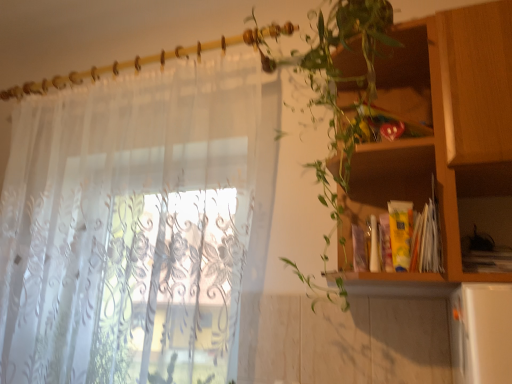
Describe the element at coordinates (137, 225) in the screenshot. I see `translucent white curtain at left` at that location.

Locate an element on the screen. The width and height of the screenshot is (512, 384). green leafy plant at upper right is located at coordinates click(339, 82).

Where is `translucent white curtain at left`? This screenshot has height=384, width=512. translucent white curtain at left is located at coordinates (137, 225).

Between green leafy plant at upper right and wooden cabinet at right, which one is positioned in front?

Positioned in front is green leafy plant at upper right.

Locate an element on the screen. The height and width of the screenshot is (384, 512). shelf that is on the right side of green leafy plant at upper right is located at coordinates (441, 130).

Does green leafy plant at upper right have a smaller size compared to wooden cabinet at right?

Incorrect, green leafy plant at upper right is not smaller in size than wooden cabinet at right.

Would you say green leafy plant at upper right is a long distance from wooden cabinet at right?

No, there isn't a large distance between green leafy plant at upper right and wooden cabinet at right.

In the scene shown: Does wooden cabinet at right have a greater height compared to green leafy plant at upper right?

Incorrect, the height of wooden cabinet at right is not larger of that of green leafy plant at upper right.

From a real-world perspective, who is located lower, wooden cabinet at right or green leafy plant at upper right?

wooden cabinet at right is physically lower.

Is wooden cabinet at right to the left of green leafy plant at upper right from the viewer's perspective?

In fact, wooden cabinet at right is to the right of green leafy plant at upper right.

In the scene shown: Considering the sizes of objects translucent white curtain at left and green leafy plant at upper right in the image provided, who is thinner, translucent white curtain at left or green leafy plant at upper right?

With smaller width is translucent white curtain at left.

Which of these two, translucent white curtain at left or green leafy plant at upper right, is smaller?

Smaller between the two is green leafy plant at upper right.

Which object is positioned more to the left, translucent white curtain at left or green leafy plant at upper right?

Positioned to the left is translucent white curtain at left.

In the scene shown: Considering the positions of objects translucent white curtain at left and green leafy plant at upper right in the image provided, who is behind, translucent white curtain at left or green leafy plant at upper right?

translucent white curtain at left is further away from the camera.

Does green leafy plant at upper right touch translucent white curtain at left?

green leafy plant at upper right and translucent white curtain at left are not in contact.

Between green leafy plant at upper right and translucent white curtain at left, which one appears on the right side from the viewer's perspective?

Positioned to the right is green leafy plant at upper right.

From the image's perspective, is green leafy plant at upper right below translucent white curtain at left?

No, from the image's perspective, green leafy plant at upper right is not beneath translucent white curtain at left.

Where is `shelf in front of the translucent white curtain at left`? This screenshot has height=384, width=512. shelf in front of the translucent white curtain at left is located at coordinates (441, 130).

Is wooden cabinet at right positioned beyond the bounds of translucent white curtain at left?

Yes, wooden cabinet at right is outside of translucent white curtain at left.

Between wooden cabinet at right and translucent white curtain at left, which one has larger size?

Bigger between the two is translucent white curtain at left.

Does point (407, 163) come in front of point (39, 257)?

Yes, point (407, 163) is in front of point (39, 257).

Looking at this image, is translucent white curtain at left beside wooden cabinet at right?

There is a gap between translucent white curtain at left and wooden cabinet at right.

Consider the image. How many degrees apart are the facing directions of translucent white curtain at left and wooden cabinet at right?

The facing directions of translucent white curtain at left and wooden cabinet at right are 0.0011 degrees apart.

Is translucent white curtain at left bigger than wooden cabinet at right?

Correct, translucent white curtain at left is larger in size than wooden cabinet at right.

Is translucent white curtain at left surrounding wooden cabinet at right?

Actually, wooden cabinet at right is outside translucent white curtain at left.

Identify the location of shelf that appears below the green leafy plant at upper right (from the image's perspective). The image size is (512, 384). (441, 130).

Identify the location of vegetation in front of the wooden cabinet at right. Image resolution: width=512 pixels, height=384 pixels. (339, 82).

Considering their positions, is green leafy plant at upper right positioned further to wooden cabinet at right than translucent white curtain at left?

translucent white curtain at left.

Based on the photo, which object lies further to the anchor point wooden cabinet at right, translucent white curtain at left or green leafy plant at upper right?

The object further to wooden cabinet at right is translucent white curtain at left.

From the image, which object appears to be farther from translucent white curtain at left, wooden cabinet at right or green leafy plant at upper right?

Among the two, wooden cabinet at right is located further to translucent white curtain at left.

Consider the image. From the image, which object appears to be nearer to translucent white curtain at left, green leafy plant at upper right or wooden cabinet at right?

The object closer to translucent white curtain at left is green leafy plant at upper right.

When comparing their distances from green leafy plant at upper right, does translucent white curtain at left or wooden cabinet at right seem further?

translucent white curtain at left lies further to green leafy plant at upper right than the other object.

From the image, which object appears to be nearer to green leafy plant at upper right, wooden cabinet at right or translucent white curtain at left?

wooden cabinet at right is positioned closer to the anchor green leafy plant at upper right.

You are a GUI agent. You are given a task and a screenshot of the screen. Output one action in this format:
    pyautogui.click(x=<x>, y=<y>)
    Task: Click on the vegetation situated between translucent white curtain at left and wooden cabinet at right from left to right
    The height and width of the screenshot is (384, 512).
    Given the screenshot: What is the action you would take?
    pyautogui.click(x=339, y=82)